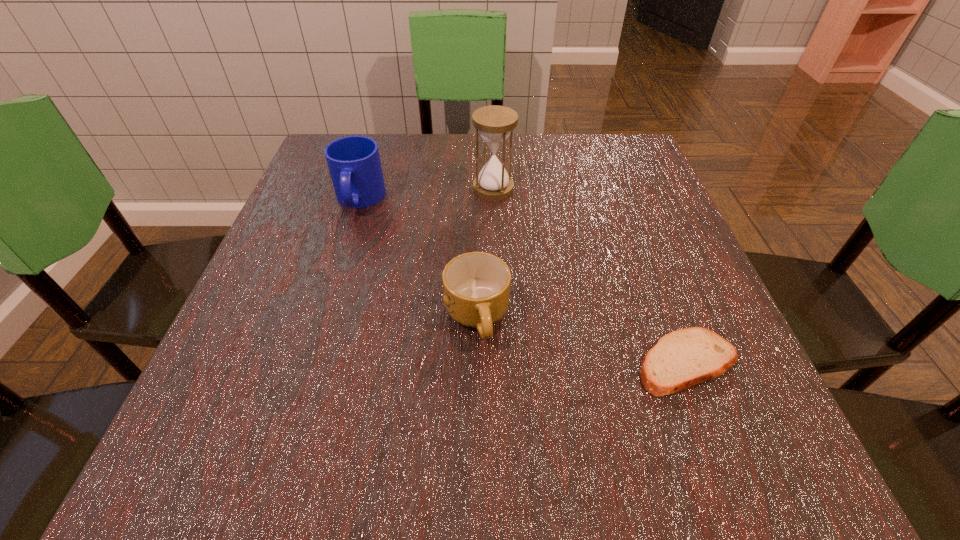
This screenshot has height=540, width=960. In order to click on the tallest object in this screenshot , I will do `click(494, 123)`.

This screenshot has width=960, height=540. Find the location of `the taller mug`. the taller mug is located at coordinates pos(354,164).

Find the location of a particular element. the third shortest object is located at coordinates (354, 164).

Find the location of a particular element. the right mug is located at coordinates (476, 286).

At what (x,y) coordinates should I click in order to perform the action: click on the second shortest object. Please return your answer as a coordinate pair (x, y). This screenshot has height=540, width=960. Looking at the image, I should click on (476, 286).

Find the location of a particular element. Image resolution: width=960 pixels, height=540 pixels. the rightmost object is located at coordinates (681, 359).

Identify the location of the shortest object. (681, 359).

This screenshot has height=540, width=960. In order to click on vacant space positioned on the left of the tallest object in this screenshot , I will do `click(321, 188)`.

Locate an element on the screen. vacant space located on the side with the handle of the leftmost object is located at coordinates (307, 364).

Where is `vacant space located on the side with the handle of the shorter mug`? The width and height of the screenshot is (960, 540). vacant space located on the side with the handle of the shorter mug is located at coordinates (476, 390).